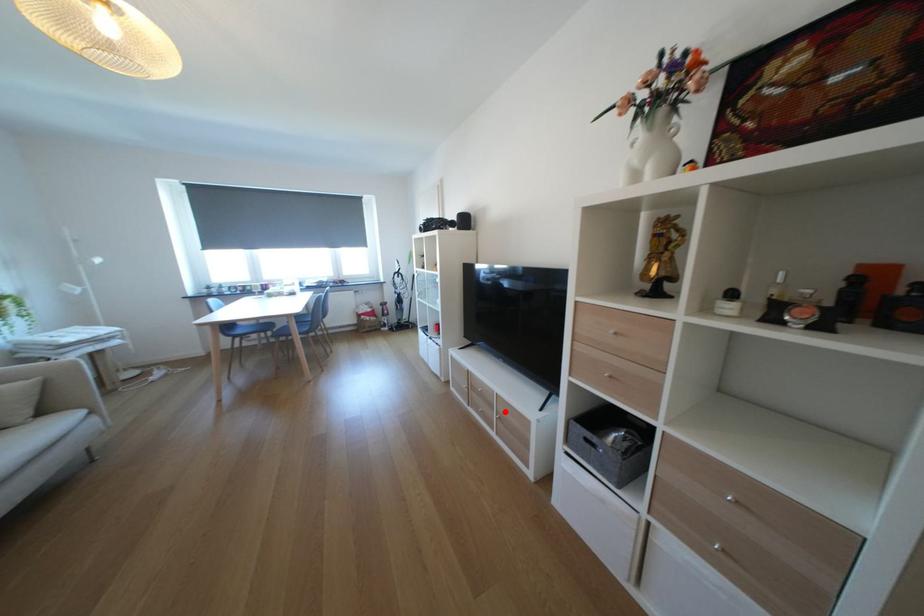
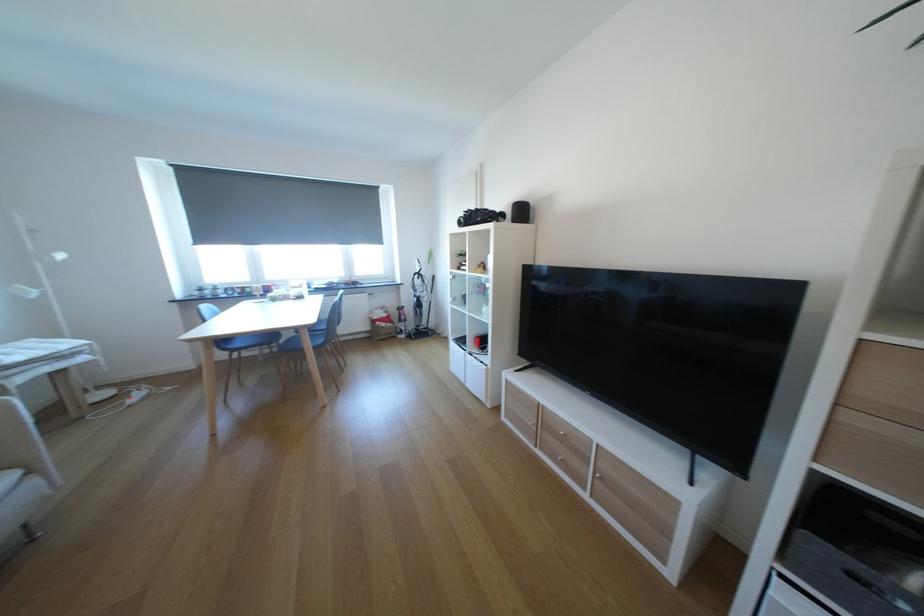
In the second image, find the point that corresponds to the highlighted location in the first image.

(600, 467)